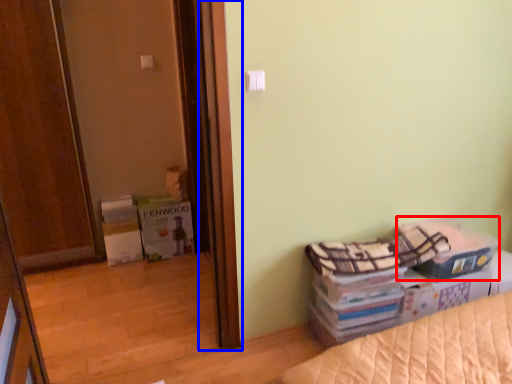
Question: Which object appears closest to the camera in this image, storage box (highlighted by a red box) or screen door (highlighted by a blue box)?

Choices:
 (A) storage box
 (B) screen door

Answer: (A)